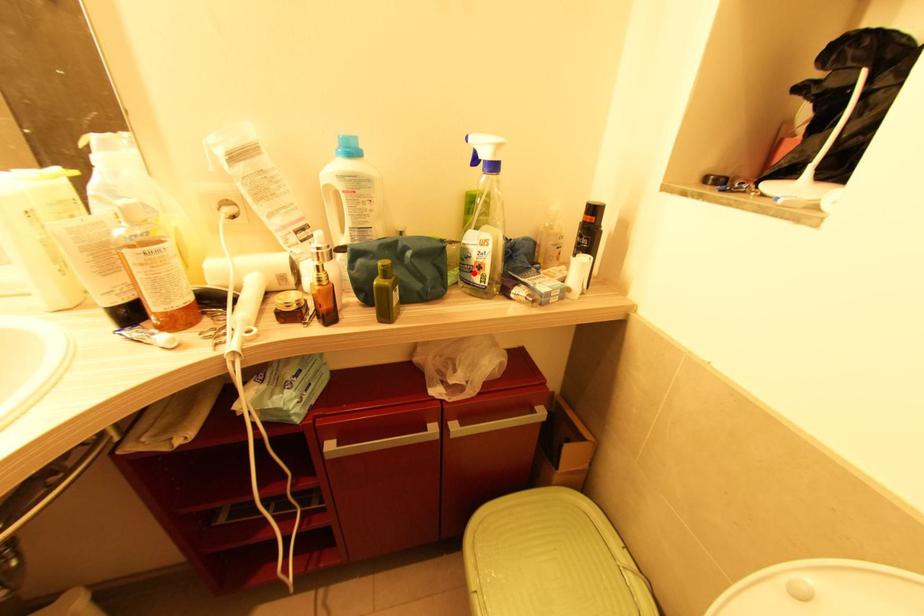
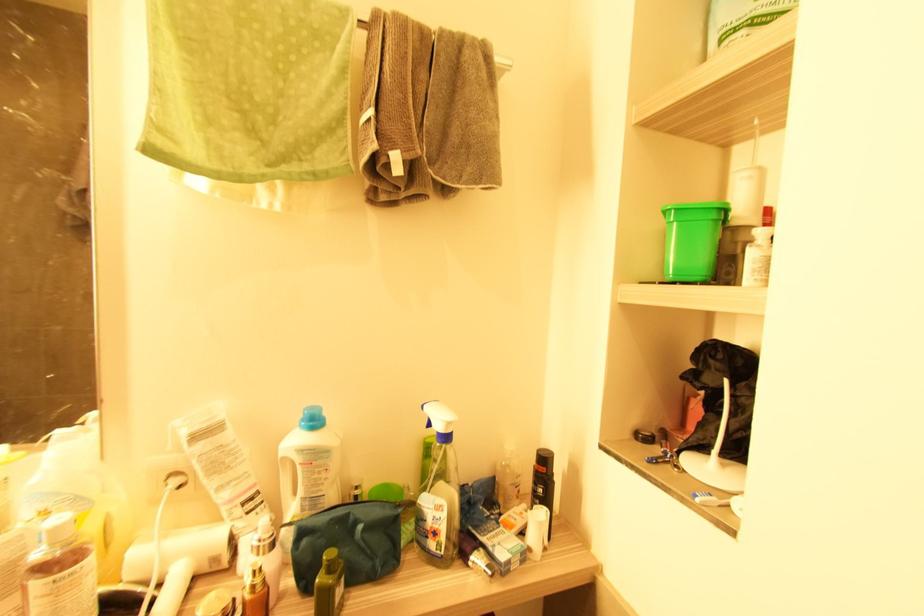
Where in the second image is the point corresponding to the highlighted location from the first image?

(429, 539)